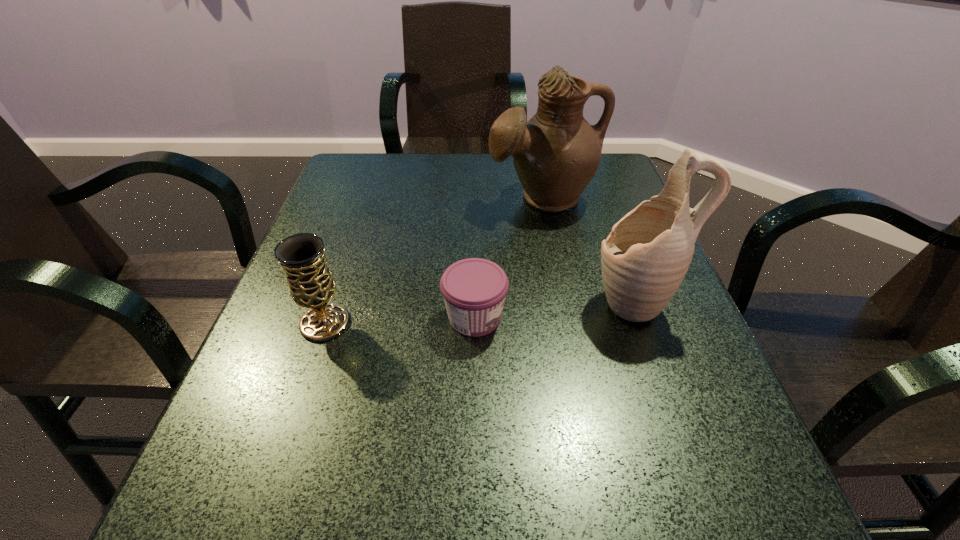
The image size is (960, 540). Identify the location of the farthest object. (556, 154).

Find the location of a particular element. The width and height of the screenshot is (960, 540). the nearer pitcher is located at coordinates (644, 259).

Identify the location of the second shortest object. (311, 284).

Locate an element on the screen. This screenshot has width=960, height=540. chalice is located at coordinates (311, 284).

Image resolution: width=960 pixels, height=540 pixels. I want to click on jam, so click(474, 289).

Identify the location of vacant space located 0.270m at the spout of the farther pitcher. (564, 307).

I want to click on vacant area situated at the spout of the nearer pitcher, so click(x=395, y=302).

At what (x,y) coordinates should I click in order to perform the action: click on free region located 0.140m at the spout of the nearer pitcher. Please return your answer as a coordinate pair (x, y). The image size is (960, 540). Looking at the image, I should click on (516, 302).

The width and height of the screenshot is (960, 540). I want to click on blank space located at the spout of the nearer pitcher, so click(x=516, y=302).

In order to click on vacant space located on the right of the chalice in this screenshot , I will do `click(511, 323)`.